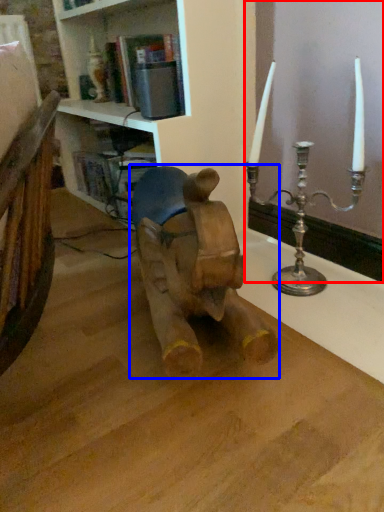
Question: Which of the following is the closest to the observer, window frame (highlighted by a red box) or animal (highlighted by a blue box)?

Choices:
 (A) window frame
 (B) animal

Answer: (B)